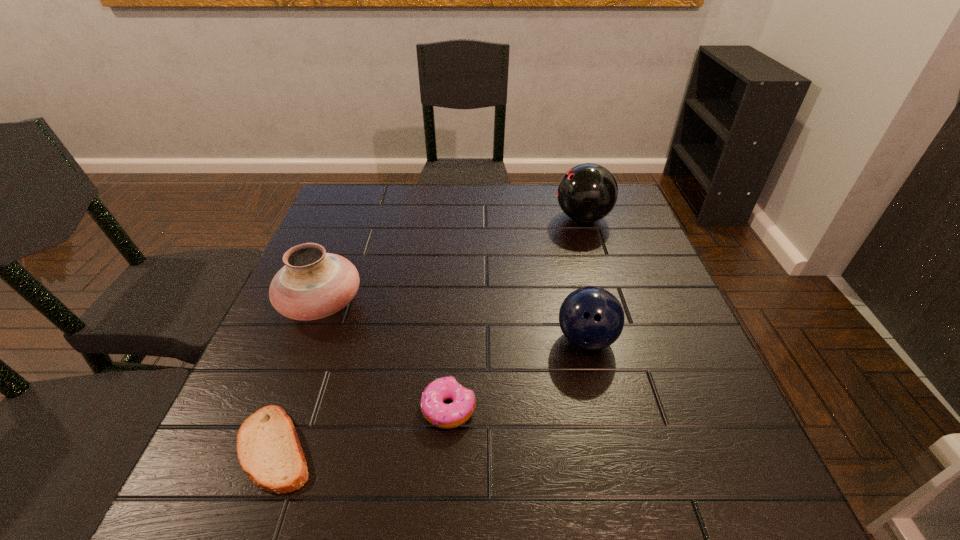
I want to click on free space located 0.400m on the back of the pottery, so click(364, 194).

Where is `vacant area located 0.230m on the surface of the shorter bowling ball near the finger holes`? The width and height of the screenshot is (960, 540). vacant area located 0.230m on the surface of the shorter bowling ball near the finger holes is located at coordinates coord(619,477).

I want to click on vacant space located on the left of the second shortest object, so click(308, 408).

Where is `vacant space situated 0.360m on the back of the pita bread`? Image resolution: width=960 pixels, height=540 pixels. vacant space situated 0.360m on the back of the pita bread is located at coordinates (338, 280).

Identify the location of object positioned at the far edge. (588, 192).

Find the location of a particular element. The height and width of the screenshot is (540, 960). object that is at the near edge is located at coordinates (268, 448).

What are the coordinates of `pottery at the left edge` in the screenshot? It's located at (313, 284).

You are a GUI agent. You are given a task and a screenshot of the screen. Output one action in this format:
    pyautogui.click(x=<x>, y=<y>)
    Task: Click on the pita bread that is at the left edge
    The height and width of the screenshot is (540, 960).
    Given the screenshot: What is the action you would take?
    268,448

The image size is (960, 540). What are the coordinates of `object at the right edge` in the screenshot? It's located at (588, 192).

Find the location of a particular element. The image size is (960, 540). object that is at the near left corner is located at coordinates (268, 448).